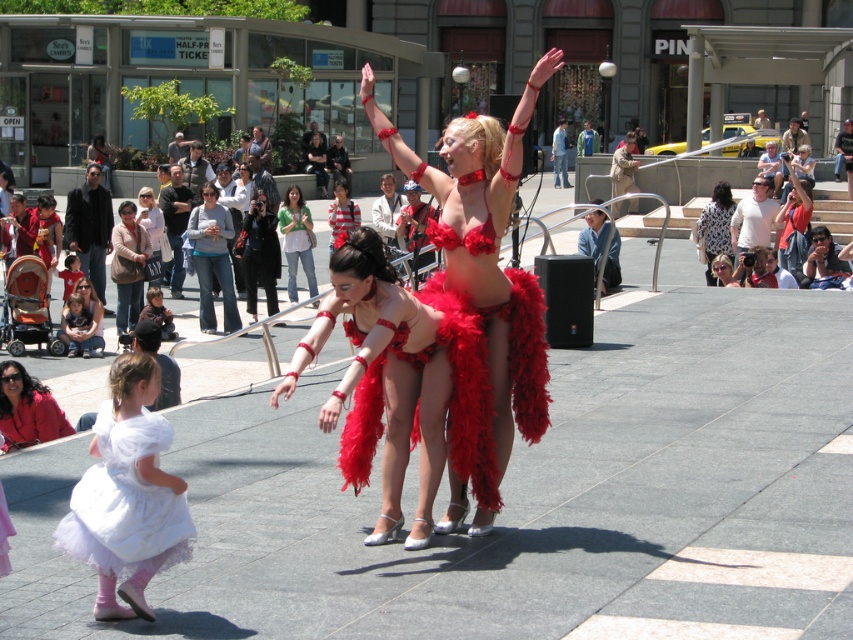
Looking at this image, is red feathered bikini at center below matte black camera at upper right?

Yes.

Does red feathered bikini at center appear over matte black camera at upper right?

Incorrect, red feathered bikini at center is not positioned above matte black camera at upper right.

Who is more distant from viewer, (398, 403) or (788, 205)?

The point (788, 205) is behind.

At what (x,y) coordinates should I click in order to perform the action: click on red feathered bikini at center. Please return your answer as a coordinate pair (x, y). This screenshot has height=640, width=853. Looking at the image, I should click on (381, 380).

The width and height of the screenshot is (853, 640). I want to click on matte red dress at lower left, so click(27, 410).

Can you confirm if matte red dress at lower left is positioned below red satin bikini top at center?

Yes, matte red dress at lower left is below red satin bikini top at center.

Is point (16, 440) closer to viewer compared to point (437, 220)?

Yes, point (16, 440) is closer to viewer.

You are a GUI agent. You are given a task and a screenshot of the screen. Output one action in this format:
    pyautogui.click(x=<x>, y=<y>)
    Task: Click on the matte red dress at lower left
    
    Given the screenshot: What is the action you would take?
    pyautogui.click(x=27, y=410)

Is green fabric shirt at center smaller than red satin bikini top at center?

Incorrect, green fabric shirt at center is not smaller in size than red satin bikini top at center.

Which is behind, point (312, 243) or point (444, 202)?

The point (312, 243) is more distant.

Between point (283, 241) and point (433, 240), which one is positioned behind?

Point (283, 241)

At what (x,y) coordinates should I click in order to perform the action: click on green fabric shirt at center. Please return your answer as a coordinate pair (x, y). The image size is (853, 640). Looking at the image, I should click on (296, 240).